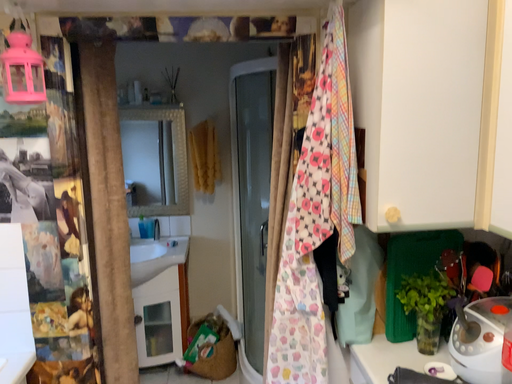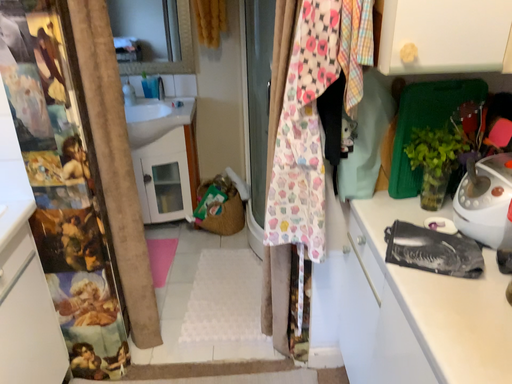
Question: Which way did the camera rotate in the video?

Choices:
 (A) rotated upward
 (B) rotated downward

Answer: (B)